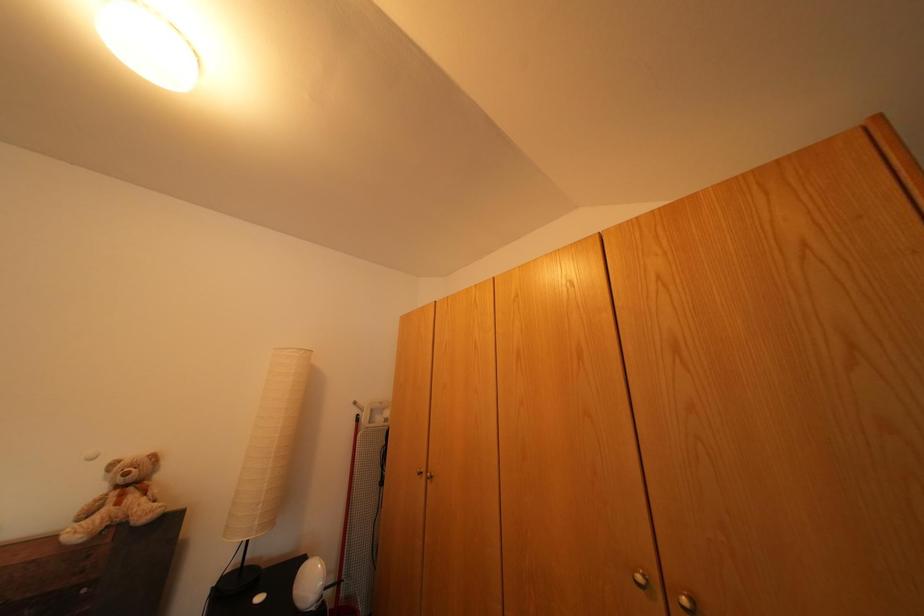
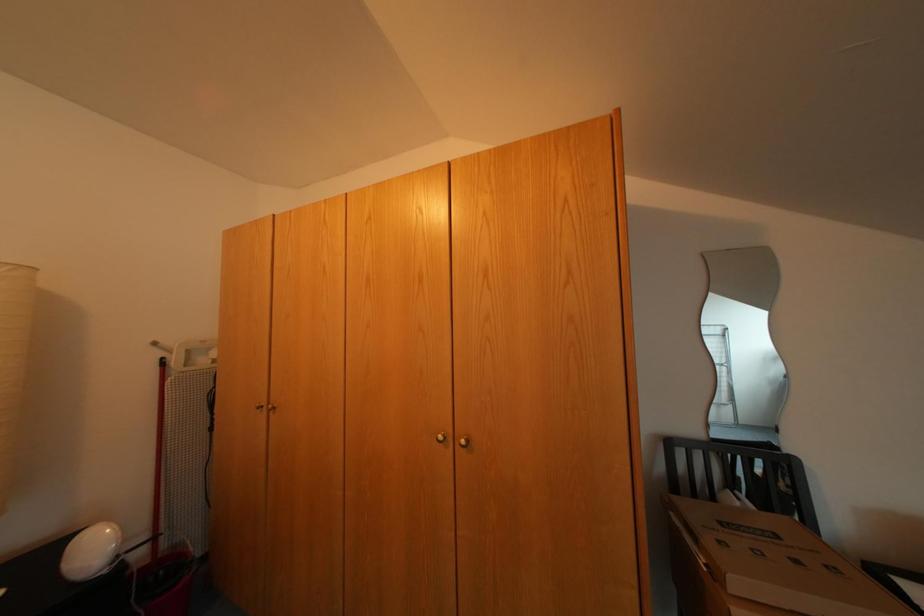
Which direction would the cameraman need to move to produce the second image?

The cameraman walked toward right, backward.